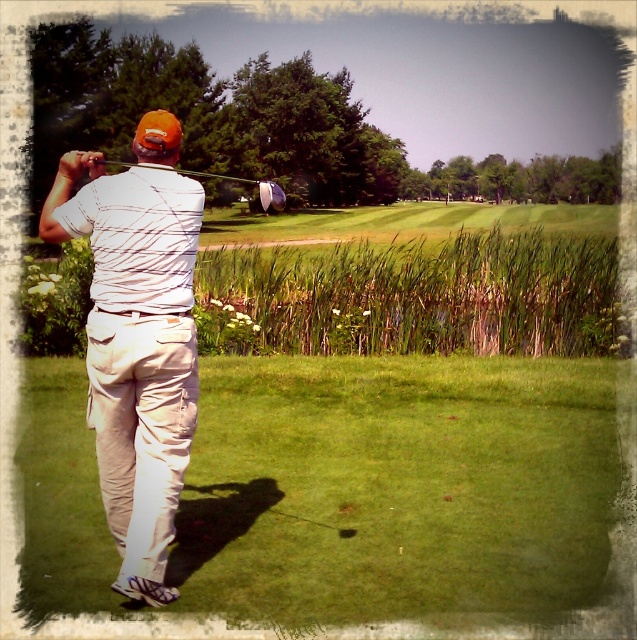
Question: Which point is farther from the camera taking this photo?

Choices:
 (A) (132, 410)
 (B) (420, 588)
 (C) (262, 180)

Answer: (C)

Question: Which is farther from the green grass at center?

Choices:
 (A) white cotton shirt at center
 (B) metallic silver golf club at upper center

Answer: (B)

Question: Which object is farther from the camera taking this photo?

Choices:
 (A) metallic silver golf club at upper center
 (B) white cotton shirt at center

Answer: (A)

Question: Is green grass at center positioned in front of metallic silver golf club at upper center?

Choices:
 (A) yes
 (B) no

Answer: (B)

Question: Does green grass at center appear on the left side of metallic silver golf club at upper center?

Choices:
 (A) no
 (B) yes

Answer: (A)

Question: Can you confirm if green grass at center is positioned to the left of metallic silver golf club at upper center?

Choices:
 (A) no
 (B) yes

Answer: (A)